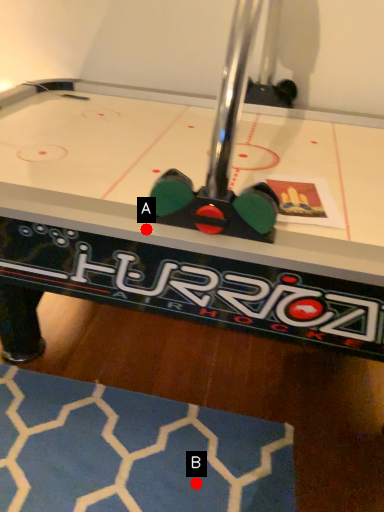
Question: Two points are circled on the image, labeled by A and B beside each circle. Which of the following is the farthest from the observer?

Choices:
 (A) A is further
 (B) B is further

Answer: (B)